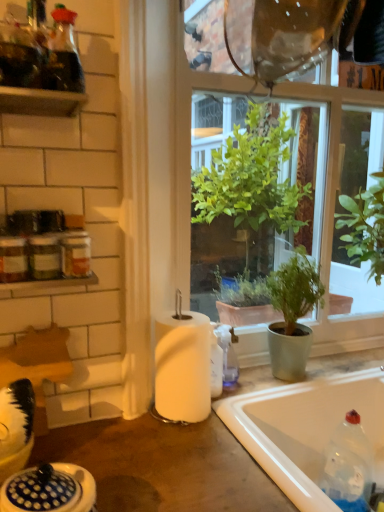
The image size is (384, 512). Find the location of `free location to the right of white glossy sink at lower left`. free location to the right of white glossy sink at lower left is located at coordinates (167, 489).